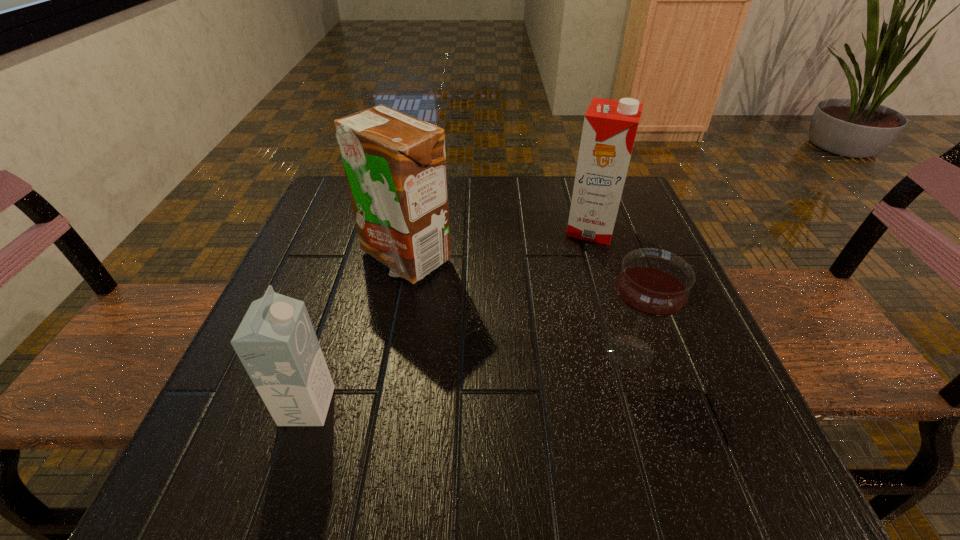
This screenshot has width=960, height=540. Find the location of `the rightmost carton`. the rightmost carton is located at coordinates (610, 126).

Find the location of a particular element. The image size is (960, 540). the shortest carton is located at coordinates (276, 342).

This screenshot has height=540, width=960. In order to click on the nearest object in this screenshot , I will do `click(276, 342)`.

Locate an element on the screen. This screenshot has height=540, width=960. the second nearest object is located at coordinates (653, 283).

At what (x,y) coordinates should I click in order to perform the action: click on wineglass. Please return your answer as a coordinate pair (x, y). Looking at the image, I should click on (653, 283).

Find the location of a particular element. This screenshot has height=540, width=960. vacant space situated on the left of the rightmost carton is located at coordinates (500, 228).

The image size is (960, 540). I want to click on free space located on the front label of the shortest carton, so click(x=406, y=406).

Find the location of a particular element. free region located on the front of the wineglass is located at coordinates (660, 446).

Locate an element on the screen. The width and height of the screenshot is (960, 540). carton located at the right edge is located at coordinates (610, 126).

Image resolution: width=960 pixels, height=540 pixels. What are the coordinates of `wineglass that is at the right edge` in the screenshot? It's located at (653, 283).